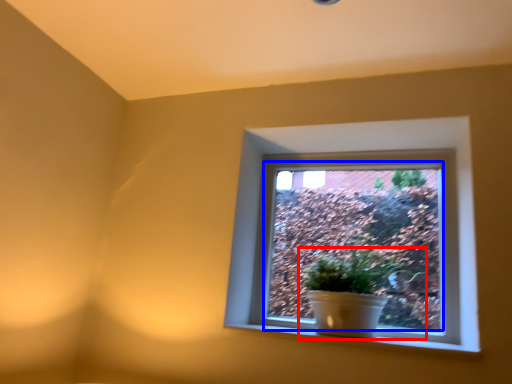
Question: Which of the following is the closest to the observer, houseplant (highlighted by a red box) or window screen (highlighted by a blue box)?

Choices:
 (A) houseplant
 (B) window screen

Answer: (A)